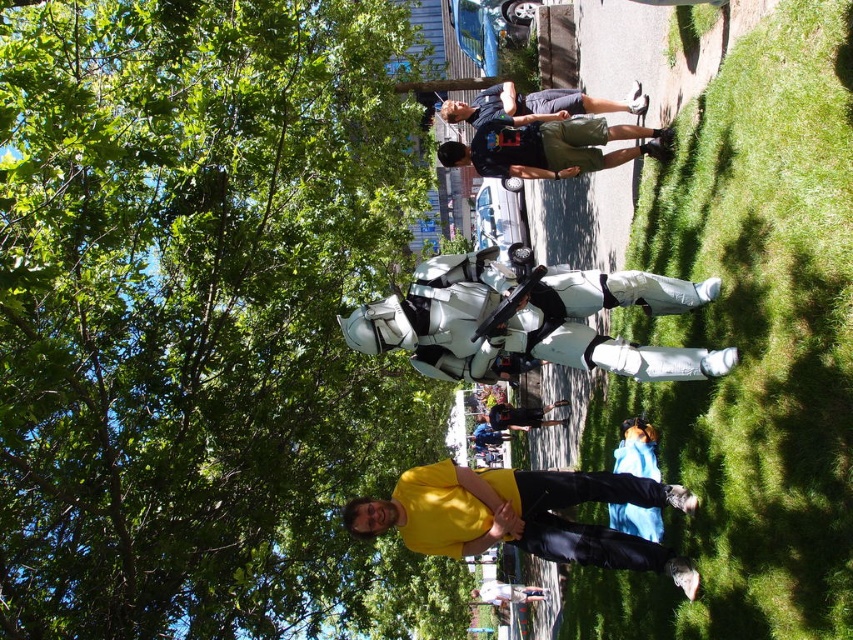
Does yellow matte shirt at lower center have a larger size compared to dark blue t-shirt at center?

Actually, yellow matte shirt at lower center might be smaller than dark blue t-shirt at center.

Is point (508, 486) less distant than point (601, 100)?

That is True.

Who is more distant from viewer, [425,550] or [637,99]?

The point [637,99] is more distant.

The width and height of the screenshot is (853, 640). Find the location of `yellow matte shirt at lower center`. yellow matte shirt at lower center is located at coordinates (521, 515).

Looking at this image, which of these two, green leafy tree at upper left or yellow matte shirt at lower center, stands shorter?

Standing shorter between the two is yellow matte shirt at lower center.

Can you confirm if green leafy tree at upper left is positioned above yellow matte shirt at lower center?

Indeed, green leafy tree at upper left is positioned over yellow matte shirt at lower center.

This screenshot has height=640, width=853. Identify the location of green leafy tree at upper left. pos(202,321).

At what (x,y) coordinates should I click in order to perform the action: click on green leafy tree at upper left. Please return your answer as a coordinate pair (x, y). Looking at the image, I should click on (202, 321).

Does green leafy tree at upper left come in front of dark blue t-shirt at center?

Yes, green leafy tree at upper left is in front of dark blue t-shirt at center.

Is green leafy tree at upper left to the right of dark blue t-shirt at center from the viewer's perspective?

In fact, green leafy tree at upper left is to the left of dark blue t-shirt at center.

Between point (120, 522) and point (560, 93), which one is positioned in front?

Positioned in front is point (120, 522).

At what (x,y) coordinates should I click in order to perform the action: click on green leafy tree at upper left. Please return your answer as a coordinate pair (x, y). Looking at the image, I should click on (202, 321).